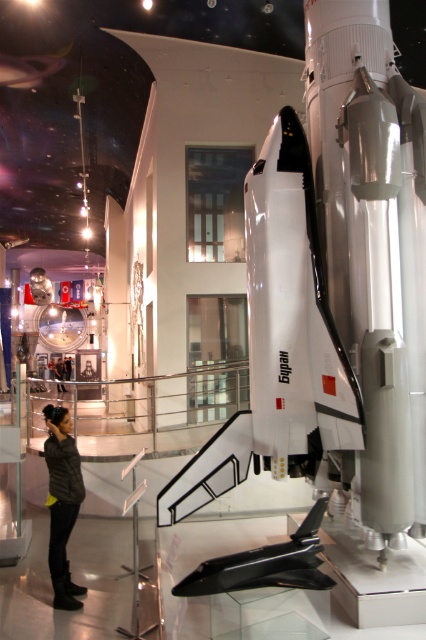
You are a visitor at the exhibition and want to take a photo of the white matte space shuttle at center while standing near the dark gray leather jacket at lower left. Can you see the shuttle in your camera frame without moving your position?

Yes, the white matte space shuttle at center is to the right of the dark gray leather jacket at lower left, so you can see it in your camera frame while standing there without moving.